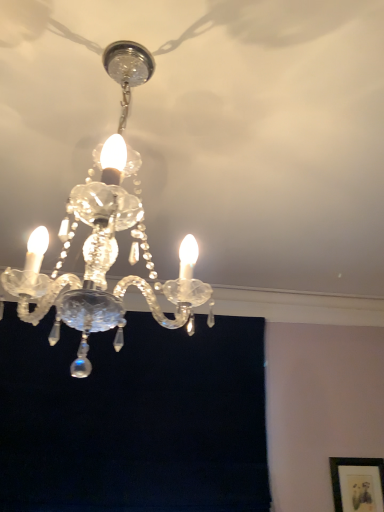
Measure the distance between point (81, 313) and camera.

Point (81, 313) and camera are 27.05 inches apart.

Image resolution: width=384 pixels, height=512 pixels. Describe the element at coordinates (114, 236) in the screenshot. I see `clear crystal chandelier at upper center` at that location.

The width and height of the screenshot is (384, 512). I want to click on clear crystal chandelier at upper center, so click(114, 236).

You are a GUI agent. You are given a task and a screenshot of the screen. Output one action in this format:
    pyautogui.click(x=<x>, y=<y>)
    Task: Click on the clear crystal chandelier at upper center
    The width and height of the screenshot is (384, 512).
    Given the screenshot: What is the action you would take?
    pyautogui.click(x=114, y=236)